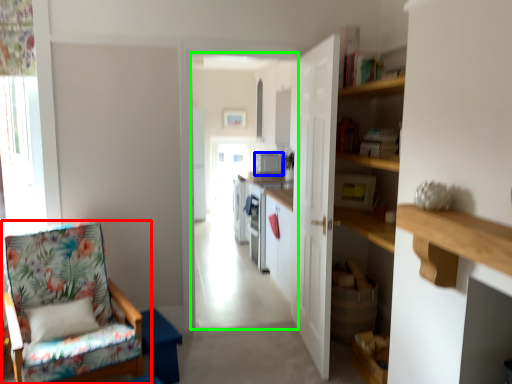
Question: Estimate the real-world distances between objects in this image. Which object is farther from chair (highlighted by a red box), appliance (highlighted by a blue box) or corridor (highlighted by a green box)?

Choices:
 (A) appliance
 (B) corridor

Answer: (B)